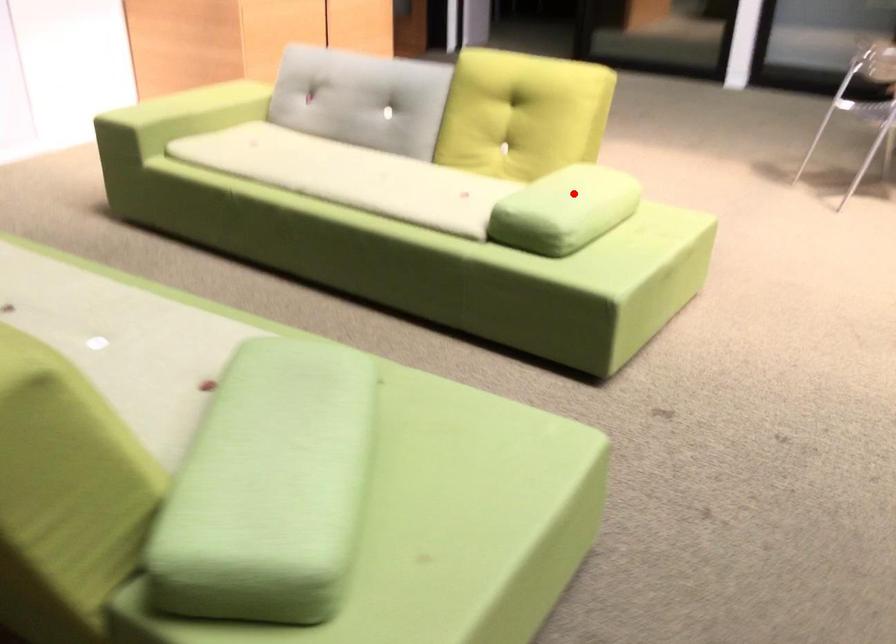
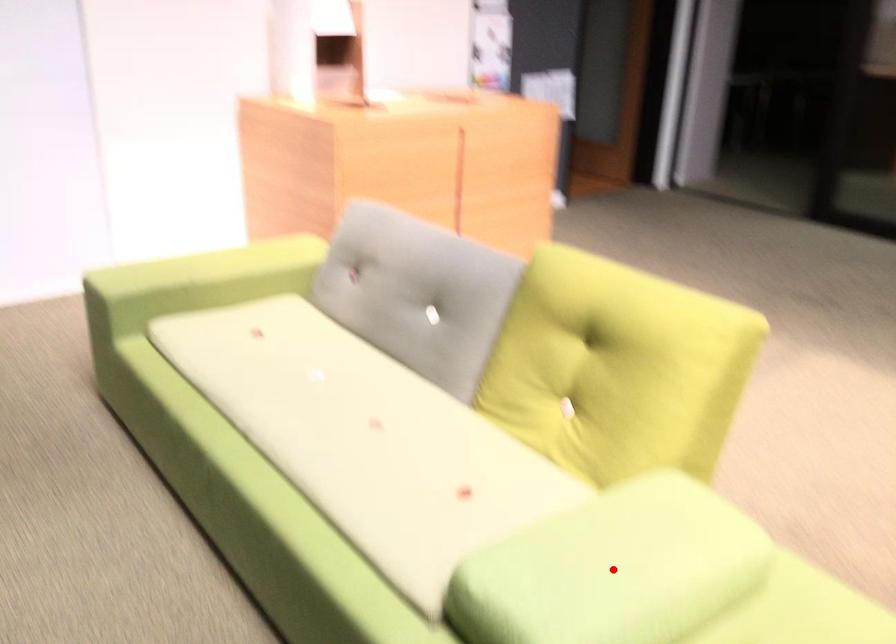
I am providing you with two images of the same scene from different viewpoints. A red point is marked on the first image and another point is marked on the second image. Is the red point in image1 aligned with the point shown in image2?

Yes